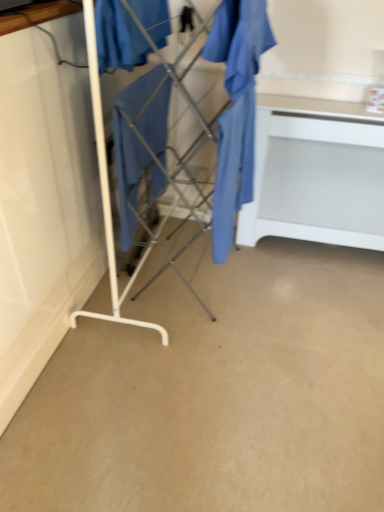
I want to click on vacant space situated above beige carpet at center (from a real-world perspective), so click(242, 345).